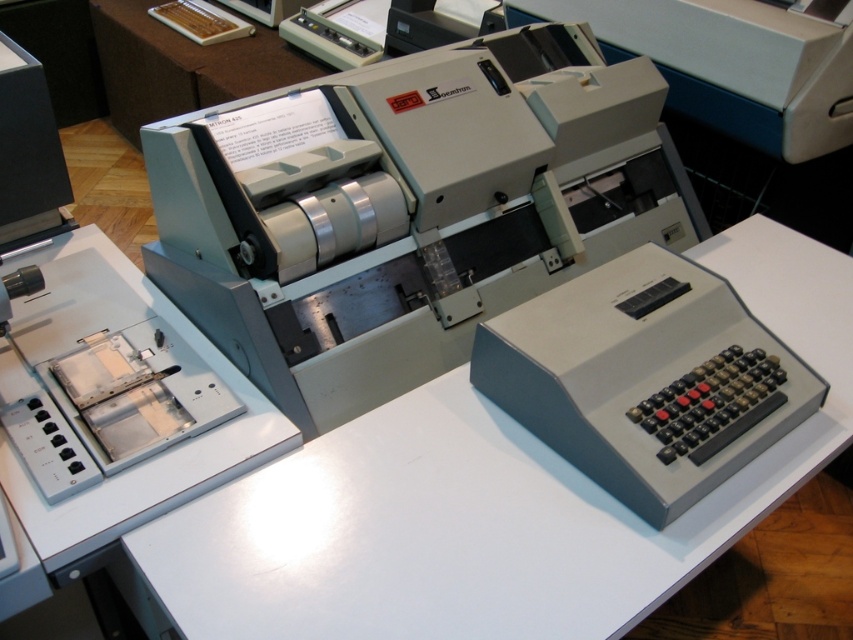
Who is lower down, white matte table at center or gray plastic calculator at lower right?

white matte table at center is below.

Image resolution: width=853 pixels, height=640 pixels. Describe the element at coordinates (488, 502) in the screenshot. I see `white matte table at center` at that location.

Locate an element on the screen. white matte table at center is located at coordinates (488, 502).

In order to click on white matte table at center in this screenshot , I will do `click(488, 502)`.

Measure the distance between point (236, 138) and camera.

1.22 meters

Does satin gray printer at center lie behind white matte table at center?

Yes, it is.

Who is more distant from viewer, (233, 163) or (759, 289)?

The point (759, 289) is more distant.

Identify the location of satin gray printer at center. This screenshot has width=853, height=640. (405, 209).

Is point (358, 387) positioned behind point (544, 342)?

That is True.

Does satin gray printer at center appear on the left side of gray plastic calculator at lower right?

Correct, you'll find satin gray printer at center to the left of gray plastic calculator at lower right.

Where is `satin gray printer at center`? satin gray printer at center is located at coordinates (405, 209).